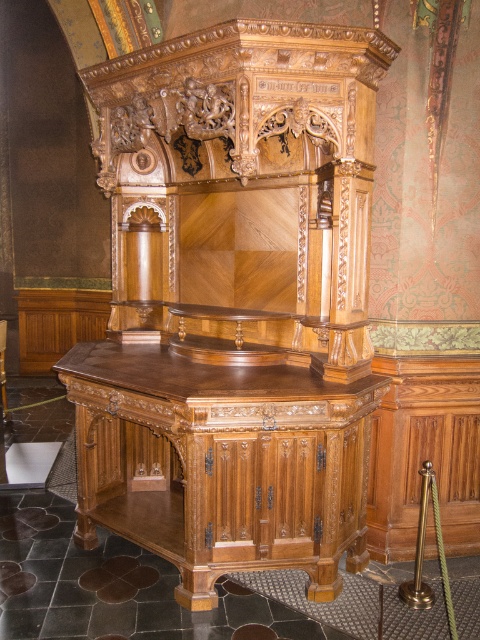
You are standing in front of the wooden structure and notice two points marked on it. The first point is at coordinates point (153, 362) and the second is at point (0, 378). Which of these points is nearer to you?

Point (153, 362) is closer to the viewer than point (0, 378).